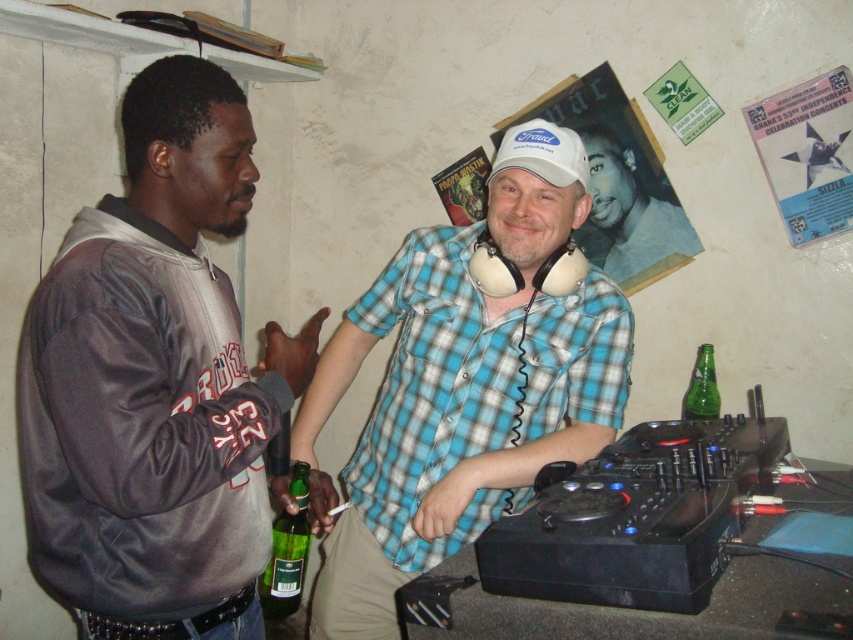
Looking at this image, measure the distance from gray leather jacket at left to blue plaid shirt at center.

A distance of 14.00 inches exists between gray leather jacket at left and blue plaid shirt at center.

How much distance is there between gray leather jacket at left and blue plaid shirt at center?

A distance of 14.00 inches exists between gray leather jacket at left and blue plaid shirt at center.

This screenshot has height=640, width=853. In order to click on gray leather jacket at left in this screenshot , I will do `click(155, 381)`.

Locate an element on the screen. This screenshot has width=853, height=640. gray leather jacket at left is located at coordinates (155, 381).

Does blue plaid shirt at center appear on the left side of green glass bottle at lower right?

Correct, you'll find blue plaid shirt at center to the left of green glass bottle at lower right.

Is blue plaid shirt at center above green glass bottle at lower right?

Yes, blue plaid shirt at center is above green glass bottle at lower right.

Identify the location of blue plaid shirt at center. (462, 387).

Is point (389, 404) behind point (606, 225)?

That is False.

Between point (509, 454) and point (589, 156), which one is positioned in front?

Point (509, 454) is more forward.

At what (x,y) coordinates should I click in order to perform the action: click on blue plaid shirt at center. Please return your answer as a coordinate pair (x, y). Looking at the image, I should click on (462, 387).